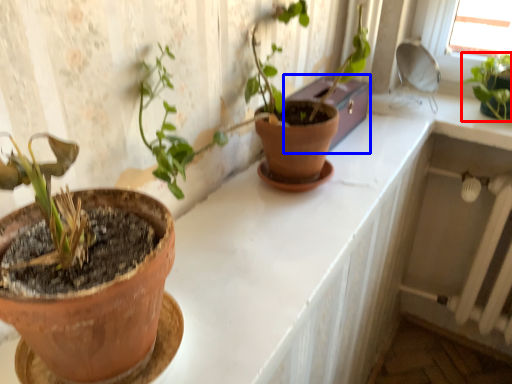
Question: Which object is further to the camera taking this photo, houseplant (highlighted by a red box) or window box (highlighted by a blue box)?

Choices:
 (A) houseplant
 (B) window box

Answer: (A)